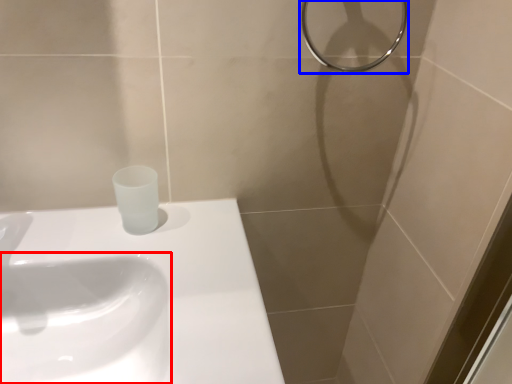
Question: Which object is closer to the camera taking this photo, sink (highlighted by a red box) or shower (highlighted by a blue box)?

Choices:
 (A) sink
 (B) shower

Answer: (A)